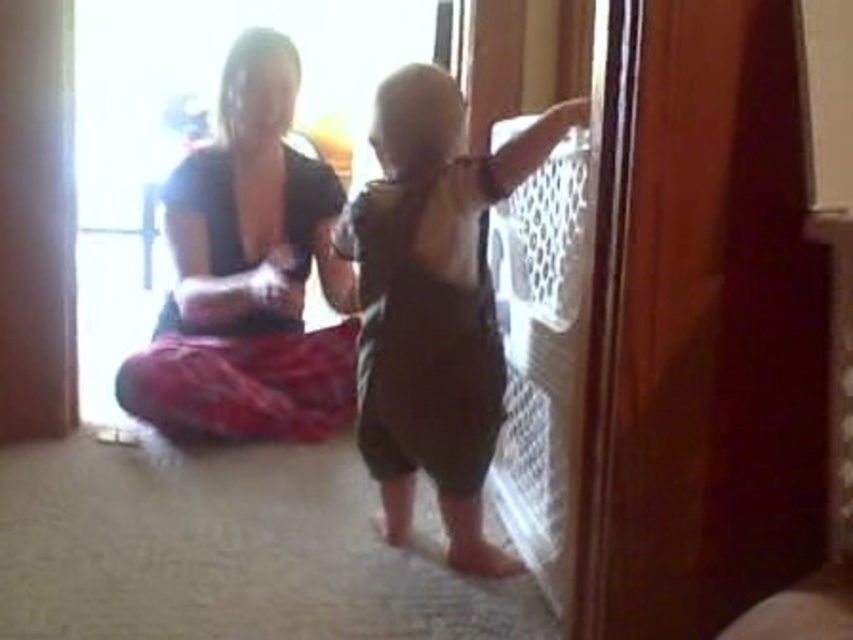
Where is the matte black shirt at center located in the image?

The matte black shirt at center is located at point coordinates of (x=248, y=275).

You are a photographer setting up a shoot in this room. You need to position a light source to the left of the matte black shirt at center and to the right of the dark brown cotton onesie at right. Is this possible given their positions?

The matte black shirt at center is to the left of the dark brown cotton onesie at right, so placing a light source to the left of the matte black shirt at center and to the right of the dark brown cotton onesie at right is not possible because the onesie is already to the right of the shirt.

You are a delivery person who needs to place a 24 inch box between the matte black shirt at center and the dark brown cotton onesie at right. Is there enough space to fit the box without moving either item?

The distance between the matte black shirt at center and the dark brown cotton onesie at right is 26.36 inches. Since the box is 24 inches long, there is enough space to place it between them without moving either item.